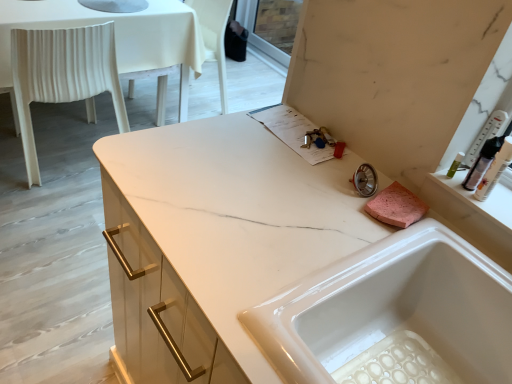
Question: Considering the relative sizes of white plastic chair at left and white glossy sink at center in the image provided, is white plastic chair at left thinner than white glossy sink at center?

Choices:
 (A) no
 (B) yes

Answer: (A)

Question: Is white plastic chair at left smaller than white glossy sink at center?

Choices:
 (A) yes
 (B) no

Answer: (B)

Question: From a real-world perspective, is white plastic chair at left positioned under white glossy sink at center based on gravity?

Choices:
 (A) no
 (B) yes

Answer: (B)

Question: Is white plastic chair at left outside of white glossy sink at center?

Choices:
 (A) no
 (B) yes

Answer: (B)

Question: Is white glossy sink at center a part of white plastic chair at left?

Choices:
 (A) yes
 (B) no

Answer: (B)

Question: From a real-world perspective, is white plastic chair at left on top of white glossy sink at center?

Choices:
 (A) yes
 (B) no

Answer: (B)

Question: Considering the relative sizes of white plastic chair at left and translucent plastic bottle at upper right in the image provided, is white plastic chair at left wider than translucent plastic bottle at upper right?

Choices:
 (A) yes
 (B) no

Answer: (A)

Question: From the image's perspective, is white plastic chair at left located beneath translucent plastic bottle at upper right?

Choices:
 (A) yes
 (B) no

Answer: (B)

Question: Is the depth of white plastic chair at left less than that of translucent plastic bottle at upper right?

Choices:
 (A) no
 (B) yes

Answer: (A)

Question: Would you say white plastic chair at left is outside translucent plastic bottle at upper right?

Choices:
 (A) no
 (B) yes

Answer: (B)

Question: Is there a large distance between white plastic chair at left and translucent plastic bottle at upper right?

Choices:
 (A) no
 (B) yes

Answer: (B)

Question: Is white plastic chair at left looking in the opposite direction of translucent plastic bottle at upper right?

Choices:
 (A) no
 (B) yes

Answer: (B)

Question: Considering the relative positions of white glossy sink at center and white plastic chair at left in the image provided, is white glossy sink at center to the left of white plastic chair at left from the viewer's perspective?

Choices:
 (A) yes
 (B) no

Answer: (B)